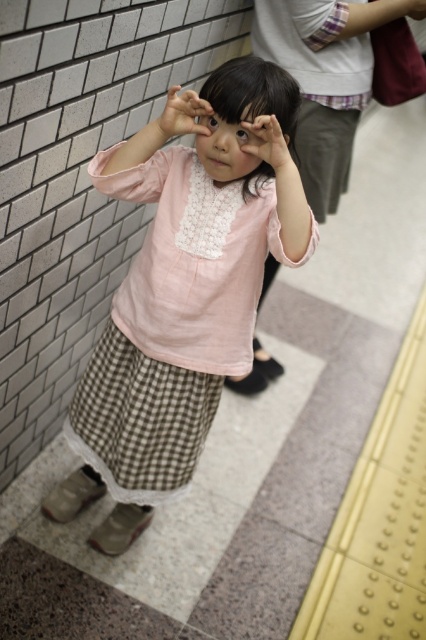
Question: Among these points, which one is farthest from the camera?

Choices:
 (A) (408, 6)
 (B) (178, 120)

Answer: (A)

Question: Which object is farther from the camera taking this photo?

Choices:
 (A) brown matte eye at center
 (B) pink cotton shirt at center

Answer: (A)

Question: Which object is closer to the camera taking this photo?

Choices:
 (A) brown matte eye at center
 (B) pink cotton shirt at center
 (C) matte pink hand at center
 (D) matte gray hand at upper center

Answer: (C)

Question: Is matte pink shirt at center closer to camera compared to brown matte eye at center?

Choices:
 (A) no
 (B) yes

Answer: (B)

Question: Can you confirm if matte pink hand at center is positioned to the right of matte pink shirt at center?

Choices:
 (A) no
 (B) yes

Answer: (A)

Question: Is black glossy eye at center bigger than brown matte eye at center?

Choices:
 (A) yes
 (B) no

Answer: (B)